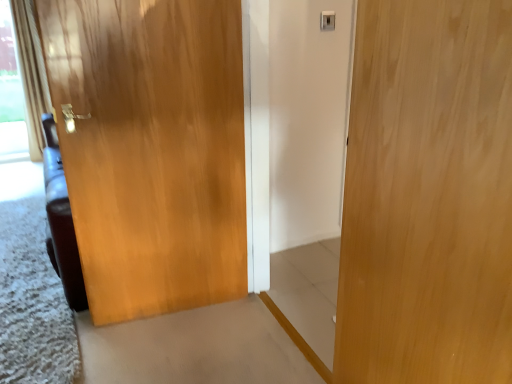
At what (x,y) coordinates should I click in order to perform the action: click on glossy wood door at left, the 1th door when ordered from left to right. Please return your answer as a coordinate pair (x, y). The height and width of the screenshot is (384, 512). Looking at the image, I should click on (152, 149).

At what (x,y) coordinates should I click in order to perform the action: click on glossy wood door at left, arranged as the 2th door when viewed from the front. Please return your answer as a coordinate pair (x, y). Looking at the image, I should click on (152, 149).

From a real-world perspective, does glossy wood door at left, the second door from the right, stand above light wood door at center, the second door in the back-to-front sequence?

No.

Considering the relative positions of glossy wood door at left, arranged as the 2th door when viewed from the front, and light wood door at center, placed as the 1th door when sorted from right to left, in the image provided, is glossy wood door at left, arranged as the 2th door when viewed from the front, to the left or to the right of light wood door at center, placed as the 1th door when sorted from right to left,?

glossy wood door at left, arranged as the 2th door when viewed from the front, is to the left of light wood door at center, placed as the 1th door when sorted from right to left.

Considering the sizes of glossy wood door at left, the second door from the right, and light wood door at center, acting as the first door starting from the front, in the image, is glossy wood door at left, the second door from the right, taller or shorter than light wood door at center, acting as the first door starting from the front,?

In the image, glossy wood door at left, the second door from the right, appears to be taller than light wood door at center, acting as the first door starting from the front.

Looking at the image, does light wood door at center, acting as the first door starting from the front, seem bigger or smaller compared to beige textured curtain at left?

Clearly, light wood door at center, acting as the first door starting from the front, is smaller in size than beige textured curtain at left.

From a real-world perspective, which is physically below, light wood door at center, acting as the first door starting from the front, or beige textured curtain at left?

In real-world perspective, light wood door at center, acting as the first door starting from the front, is lower.

Are light wood door at center, acting as the first door starting from the front, and beige textured curtain at left located far from each other?

Indeed, light wood door at center, acting as the first door starting from the front, is not near beige textured curtain at left.

Consider the image. From the image's perspective, relative to beige textured curtain at left, is light wood door at center, the second door in the back-to-front sequence, above or below?

Clearly, from the image's perspective, light wood door at center, the second door in the back-to-front sequence, is below beige textured curtain at left.

From a real-world perspective, is glossy wood door at left, which is the first door from back to front, above or below beige textured curtain at left?

glossy wood door at left, which is the first door from back to front, is situated lower than beige textured curtain at left in the real world.

Is glossy wood door at left, the 1th door when ordered from left to right, not close to beige textured curtain at left?

Yes, glossy wood door at left, the 1th door when ordered from left to right, and beige textured curtain at left are quite far apart.

Considering the points (201, 29) and (30, 44), which point is behind, point (201, 29) or point (30, 44)?

The point (201, 29) is behind.

Considering the sizes of glossy wood door at left, the second door from the right, and beige textured curtain at left in the image, is glossy wood door at left, the second door from the right, bigger or smaller than beige textured curtain at left?

Clearly, glossy wood door at left, the second door from the right, is smaller in size than beige textured curtain at left.

From the image's perspective, would you say beige textured curtain at left is positioned over glossy wood door at left, arranged as the 2th door when viewed from the front?

Indeed, from the image's perspective, beige textured curtain at left is shown above glossy wood door at left, arranged as the 2th door when viewed from the front.

Identify the location of curtain on the left of glossy wood door at left, which is the first door from back to front. (31, 73).

Looking at this image, is beige textured curtain at left positioned behind glossy wood door at left, the second door from the right?

Yes, beige textured curtain at left is further from the viewer.

Is beige textured curtain at left at the right side of glossy wood door at left, which is the first door from back to front?

No.

Can you confirm if light wood door at center, the 2th door from the left, is wider than glossy wood door at left, arranged as the 2th door when viewed from the front?

In fact, light wood door at center, the 2th door from the left, might be narrower than glossy wood door at left, arranged as the 2th door when viewed from the front.

Does light wood door at center, the second door in the back-to-front sequence, have a greater height compared to glossy wood door at left, the 1th door when ordered from left to right?

No, light wood door at center, the second door in the back-to-front sequence, is not taller than glossy wood door at left, the 1th door when ordered from left to right.

From the picture: Is light wood door at center, the second door in the back-to-front sequence, outside of glossy wood door at left, the 1th door when ordered from left to right?

light wood door at center, the second door in the back-to-front sequence, lies outside glossy wood door at left, the 1th door when ordered from left to right,'s area.

Image resolution: width=512 pixels, height=384 pixels. I want to click on door on the right of glossy wood door at left, the 1th door when ordered from left to right, so click(428, 196).

Is beige textured curtain at left turned away from light wood door at center, acting as the first door starting from the front?

beige textured curtain at left does not have its back to light wood door at center, acting as the first door starting from the front.

From the image's perspective, is beige textured curtain at left on top of light wood door at center, the 2th door from the left?

Correct, beige textured curtain at left appears higher than light wood door at center, the 2th door from the left, in the image.

Is beige textured curtain at left in front of or behind light wood door at center, placed as the 1th door when sorted from right to left, in the image?

beige textured curtain at left is positioned farther from the viewer than light wood door at center, placed as the 1th door when sorted from right to left.

Between point (46, 81) and point (369, 157), which one is positioned behind?

The point (46, 81) is behind.

Locate an element on the screen. This screenshot has height=384, width=512. door located in front of the glossy wood door at left, arranged as the 2th door when viewed from the front is located at coordinates (428, 196).

Find the location of a particular element. The image size is (512, 384). curtain located above the light wood door at center, the 2th door from the left (from a real-world perspective) is located at coordinates (31, 73).

Estimate the real-world distances between objects in this image. Which object is further from light wood door at center, placed as the 1th door when sorted from right to left, beige textured curtain at left or glossy wood door at left, which is the first door from back to front?

beige textured curtain at left lies further to light wood door at center, placed as the 1th door when sorted from right to left, than the other object.

Looking at the image, which one is located further to beige textured curtain at left, glossy wood door at left, which is the first door from back to front, or light wood door at center, acting as the first door starting from the front?

light wood door at center, acting as the first door starting from the front, is positioned further to the anchor beige textured curtain at left.

Which object lies nearer to the anchor point light wood door at center, the 2th door from the left, glossy wood door at left, the 1th door when ordered from left to right, or beige textured curtain at left?

Among the two, glossy wood door at left, the 1th door when ordered from left to right, is located nearer to light wood door at center, the 2th door from the left.

Considering their positions, is beige textured curtain at left positioned closer to glossy wood door at left, which is the first door from back to front, than light wood door at center, the second door in the back-to-front sequence?

light wood door at center, the second door in the back-to-front sequence, is closer to glossy wood door at left, which is the first door from back to front.

Based on their spatial positions, is light wood door at center, the 2th door from the left, or beige textured curtain at left further from glossy wood door at left, arranged as the 2th door when viewed from the front?

Among the two, beige textured curtain at left is located further to glossy wood door at left, arranged as the 2th door when viewed from the front.

When comparing their distances from beige textured curtain at left, does light wood door at center, the 2th door from the left, or glossy wood door at left, the second door from the right, seem further?

Among the two, light wood door at center, the 2th door from the left, is located further to beige textured curtain at left.

Where is `door between light wood door at center, acting as the first door starting from the front, and beige textured curtain at left in the front-back direction`? door between light wood door at center, acting as the first door starting from the front, and beige textured curtain at left in the front-back direction is located at coordinates click(152, 149).